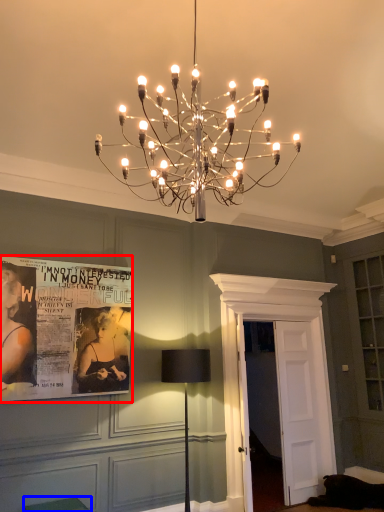
Question: Among these objects, which one is nearest to the camera, poster page (highlighted by a red box) or furniture (highlighted by a blue box)?

Choices:
 (A) poster page
 (B) furniture

Answer: (B)